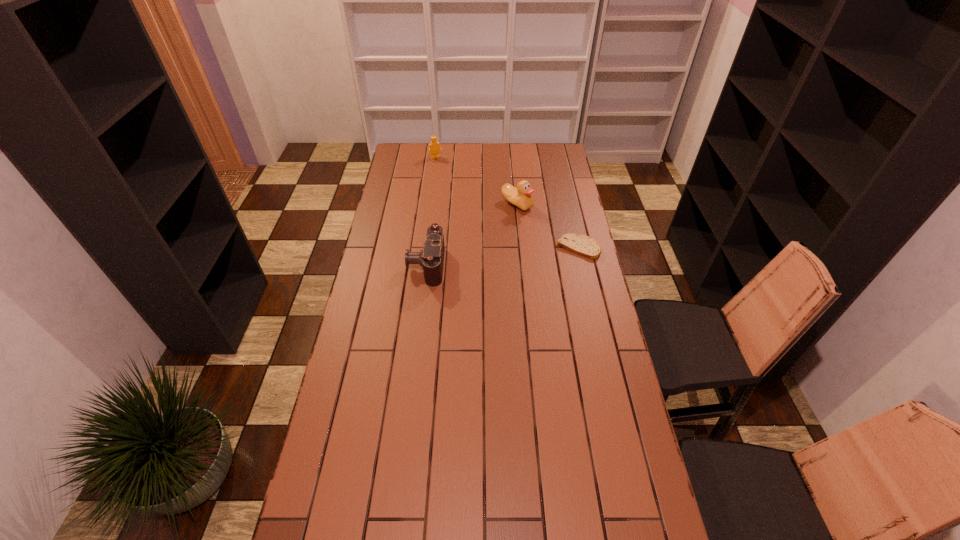
Where is `free spot at the right edge of the desktop`? This screenshot has width=960, height=540. free spot at the right edge of the desktop is located at coordinates (585, 272).

Image resolution: width=960 pixels, height=540 pixels. In the image, there is a desktop. What are the coordinates of `vacant space at the far right corner` in the screenshot? It's located at (558, 151).

This screenshot has height=540, width=960. Identify the location of vacant region between the camera and the third object from left to right. (471, 234).

Locate an element on the screen. This screenshot has width=960, height=540. vacant point located between the farthest object and the duck is located at coordinates (476, 181).

Where is `vacant space that is in between the duck and the camera`? The height and width of the screenshot is (540, 960). vacant space that is in between the duck and the camera is located at coordinates pos(471,234).

At what (x,y) coordinates should I click in order to perform the action: click on empty space between the duck and the camera. Please return your answer as a coordinate pair (x, y). The width and height of the screenshot is (960, 540). Looking at the image, I should click on (471, 234).

Where is `empty space between the Lego and the camera`? The width and height of the screenshot is (960, 540). empty space between the Lego and the camera is located at coordinates (431, 211).

Find the location of a particular element. The image size is (960, 540). unoccupied position between the pita bread and the second farthest object is located at coordinates (547, 226).

This screenshot has width=960, height=540. What are the coordinates of `free space between the second object from right to left and the rightmost object` in the screenshot? It's located at (547, 226).

At what (x,y) coordinates should I click in order to perform the action: click on vacant region between the pita bread and the camera. Please return your answer as a coordinate pair (x, y). The height and width of the screenshot is (540, 960). Looking at the image, I should click on (502, 256).